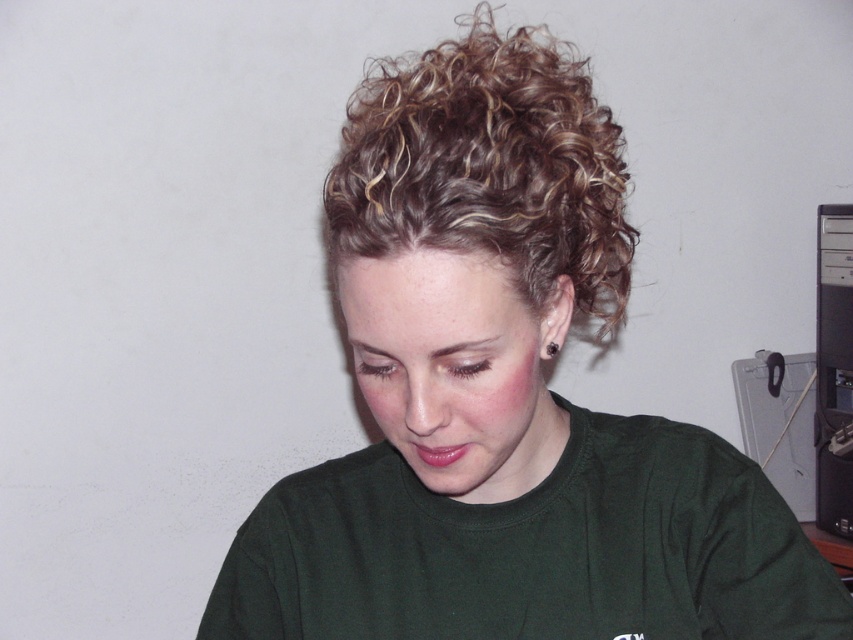
Can you confirm if curly blonde hair at upper center is positioned to the left of black plastic computer tower at right?

Correct, you'll find curly blonde hair at upper center to the left of black plastic computer tower at right.

Between point (610, 330) and point (833, 346), which one is positioned in front?

Positioned in front is point (833, 346).

Between point (480, 109) and point (838, 358), which one is positioned behind?

Point (838, 358)

You are a GUI agent. You are given a task and a screenshot of the screen. Output one action in this format:
    pyautogui.click(x=<x>, y=<y>)
    Task: Click on the curly blonde hair at upper center
    The image size is (853, 640).
    Given the screenshot: What is the action you would take?
    pyautogui.click(x=488, y=166)